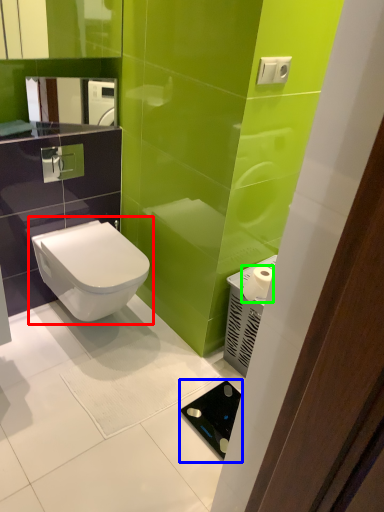
Question: Which object is the farthest from toilet (highlighted by a red box)? Choose among these: appliance (highlighted by a blue box) or toilet paper (highlighted by a green box).

Choices:
 (A) appliance
 (B) toilet paper

Answer: (A)